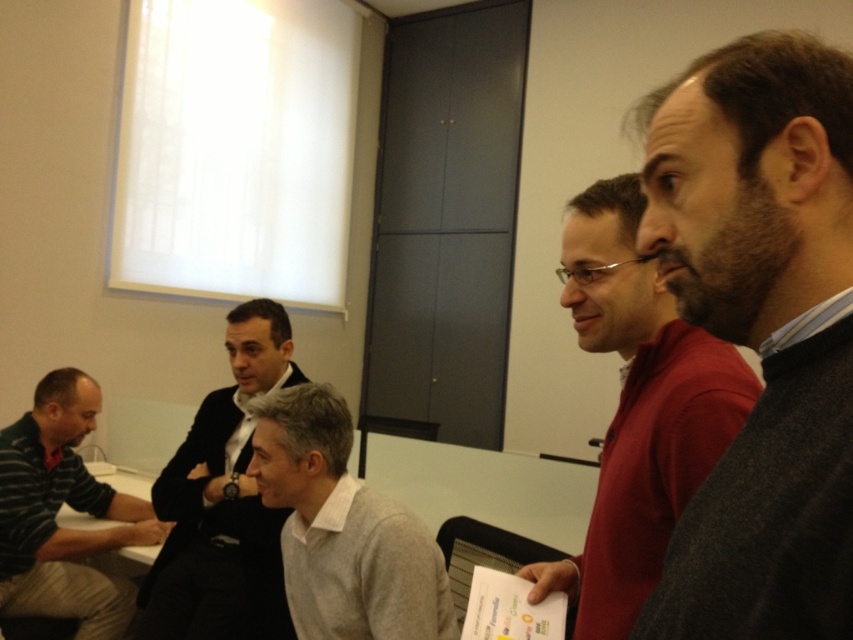
Question: Estimate the real-world distances between objects in this image. Which object is closer to the striped cotton shirt at left?

Choices:
 (A) light gray sweater at center
 (B) dark gray sweater at right
 (C) matte red sweater at center
 (D) dark gray suit at center

Answer: (D)

Question: Which is nearer to the dark gray suit at center?

Choices:
 (A) light gray sweater at center
 (B) matte red sweater at center

Answer: (A)

Question: From the image, what is the correct spatial relationship of matte red sweater at center in relation to striped cotton shirt at left?

Choices:
 (A) above
 (B) below

Answer: (A)

Question: Which point appears closest to the camera in this image?

Choices:
 (A) (416, 524)
 (B) (195, 586)

Answer: (A)

Question: From the image, what is the correct spatial relationship of dark gray sweater at right in relation to striped cotton shirt at left?

Choices:
 (A) left
 (B) right

Answer: (B)

Question: Can you confirm if light gray sweater at center is positioned to the right of striped cotton shirt at left?

Choices:
 (A) yes
 (B) no

Answer: (A)